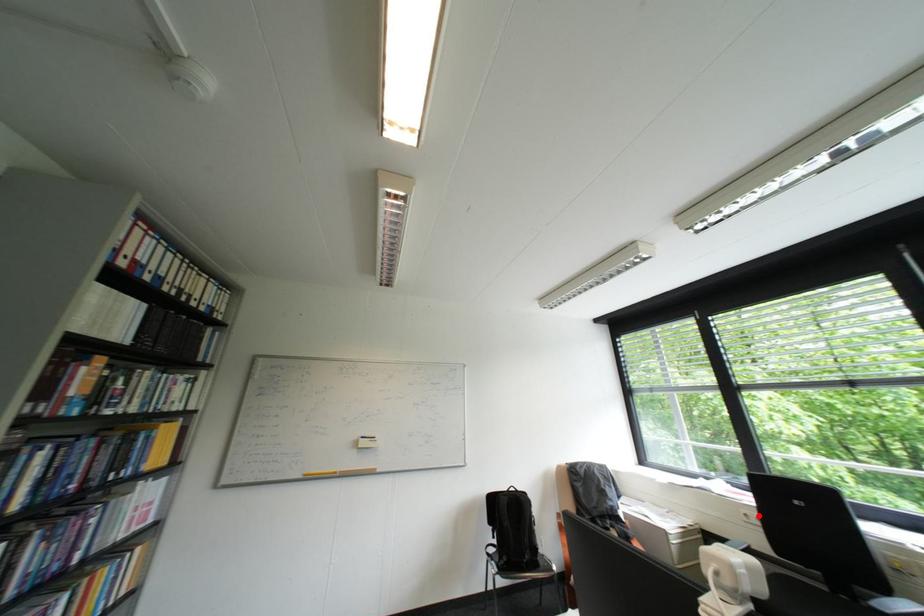
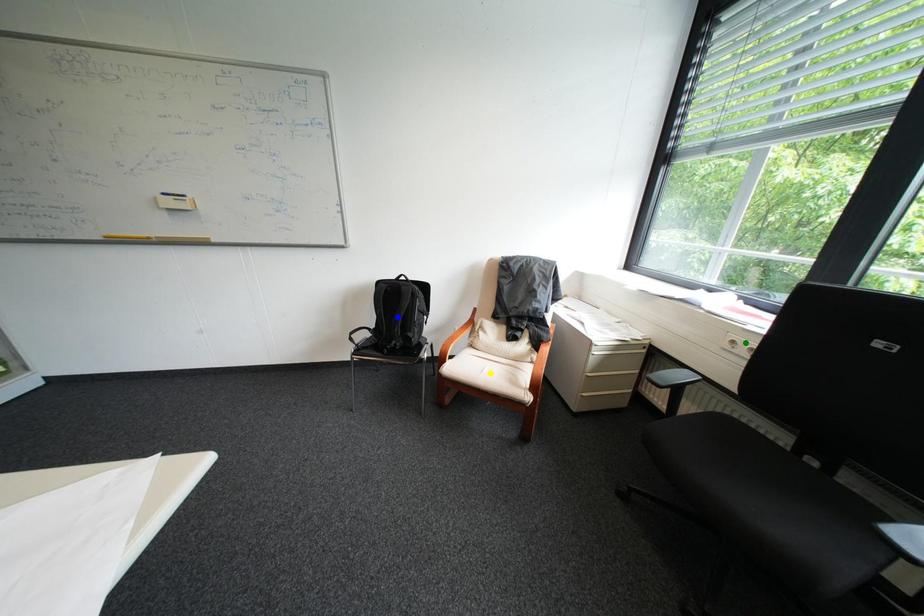
Question: I am providing you with two images of the same scene from different viewpoints. A red point is marked on the first image. You are given multiple points on the second image. In image 2, which mark is for the same physical point as the one in image 1?

Choices:
 (A) yellow point
 (B) green point
 (C) blue point

Answer: (B)